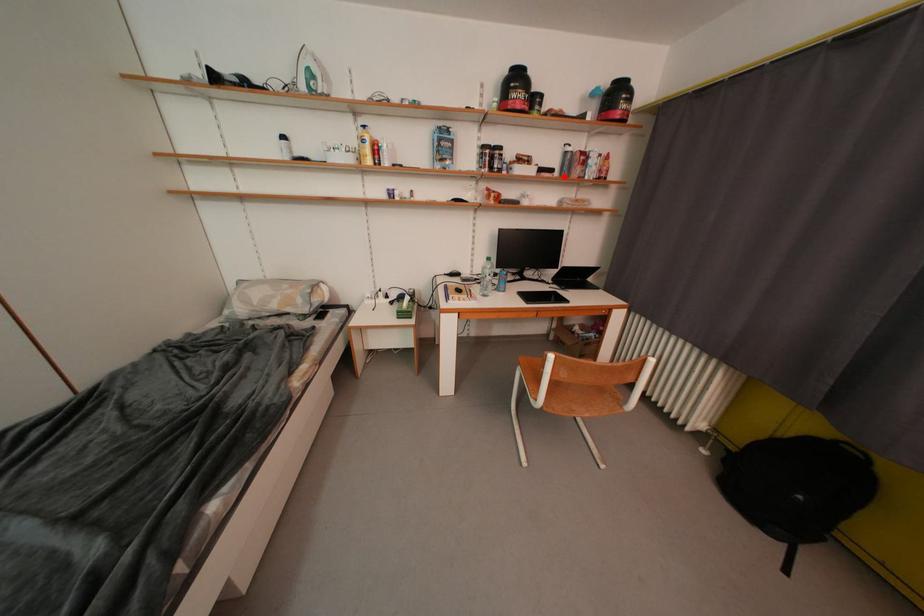
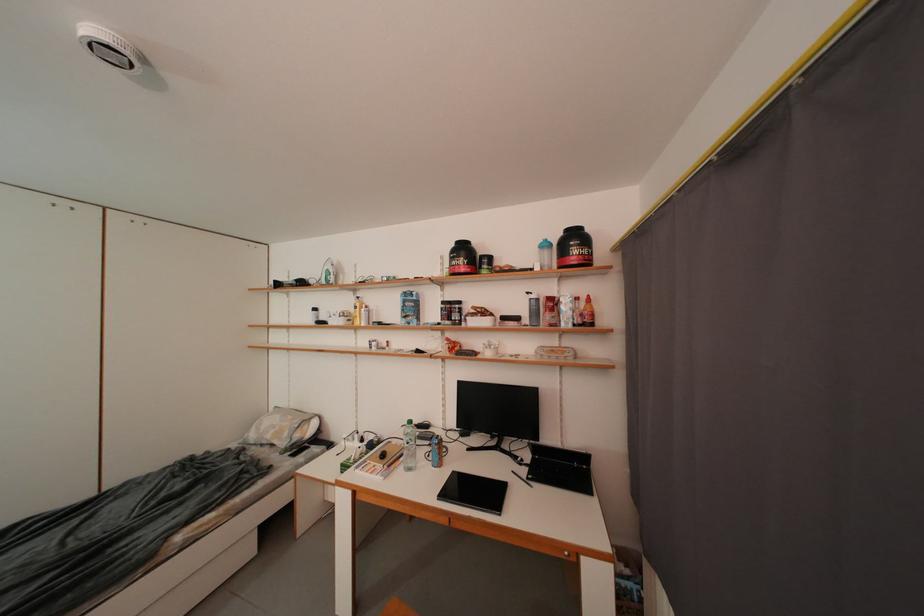
Question: I am providing you with two images of the same scene from different viewpoints. Given a red point in image1, look at the same physical point in image2. Is it:

Choices:
 (A) Closer to the viewpoint
 (B) Farther from the viewpoint

Answer: (B)